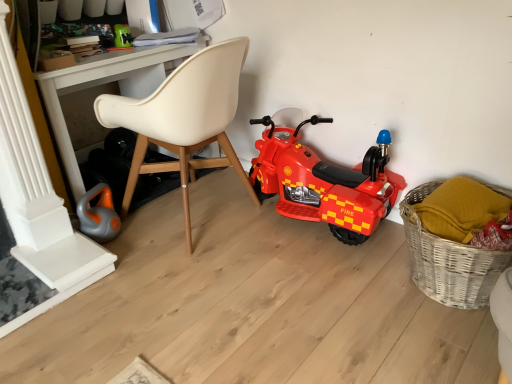
At what (x,y) coordinates should I click in order to perform the action: click on vacant area that lies between beige leather chair at center and red plastic toy motorcycle at center. Please return your answer as a coordinate pair (x, y). This screenshot has height=384, width=512. Looking at the image, I should click on (271, 238).